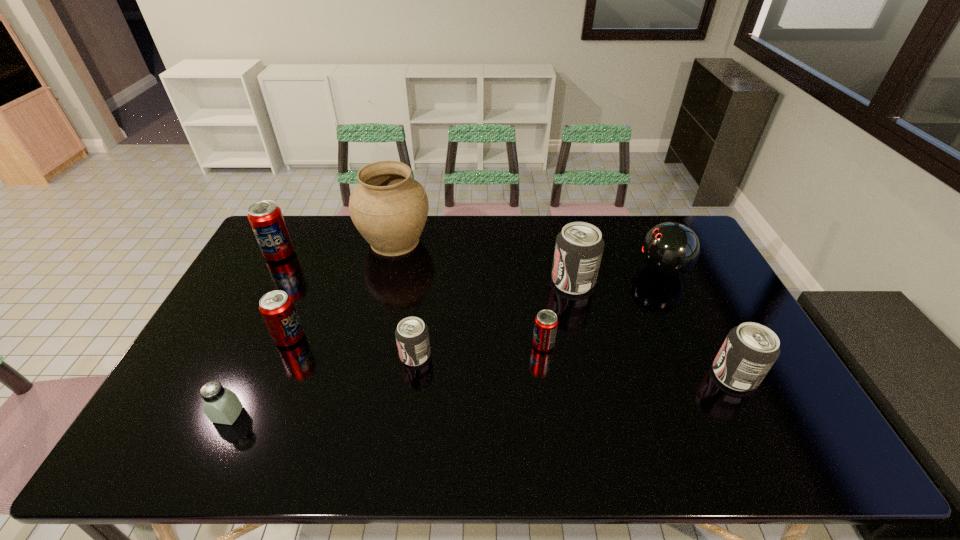
Identify the location of the tallest object. Image resolution: width=960 pixels, height=540 pixels. (389, 208).

At what (x,y) coordinates should I click in order to perform the action: click on the second soda can from right to left. Please return your answer as a coordinate pair (x, y). Looking at the image, I should click on (579, 247).

What are the coordinates of `the fifth nearest soda can` in the screenshot? It's located at (579, 247).

The width and height of the screenshot is (960, 540). What are the coordinates of `the farthest red soda can` in the screenshot? It's located at (266, 219).

Identify the location of the leftmost soda can. (266, 219).

The height and width of the screenshot is (540, 960). In order to click on bowling ball in this screenshot , I will do `click(670, 249)`.

This screenshot has width=960, height=540. In order to click on the second red soda can from right to left in this screenshot , I will do `click(277, 309)`.

This screenshot has height=540, width=960. Identify the location of the second smallest red soda can. (277, 309).

At what (x,y) coordinates should I click in order to perform the action: click on the second smallest black soda can. Please return your answer as a coordinate pair (x, y). The height and width of the screenshot is (540, 960). Looking at the image, I should click on (750, 350).

This screenshot has width=960, height=540. I want to click on the rightmost soda can, so click(750, 350).